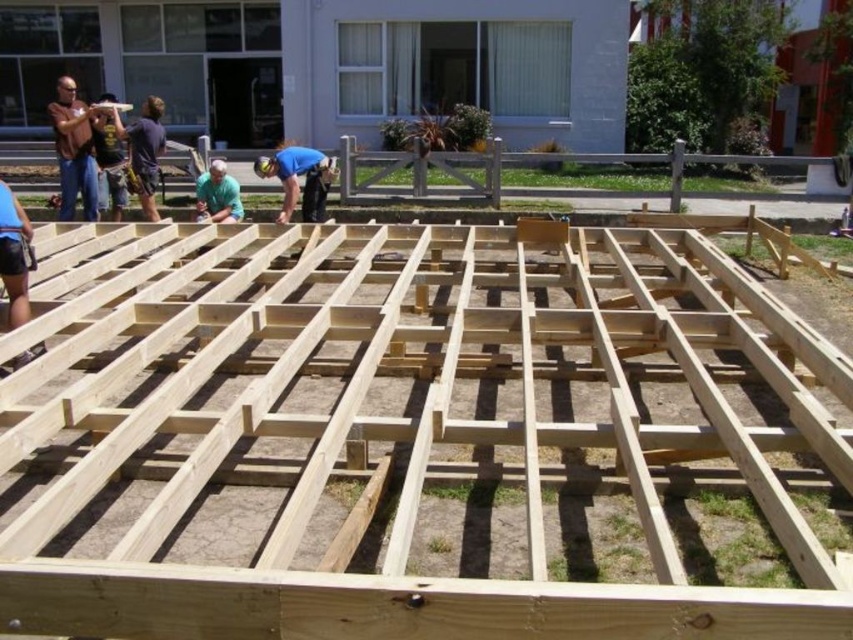
Between matte brown shirt at left and light blue shirt at center, which one is positioned lower?

Positioned lower is light blue shirt at center.

Does point (82, 157) come behind point (291, 150)?

That is False.

The image size is (853, 640). What do you see at coordinates (73, 150) in the screenshot?
I see `matte brown shirt at left` at bounding box center [73, 150].

Find the location of a particular element. The image size is (853, 640). matte brown shirt at left is located at coordinates (73, 150).